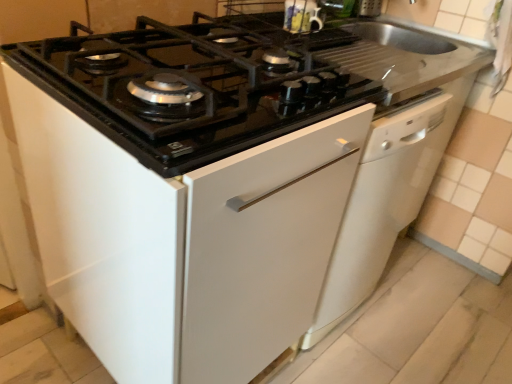
Describe the element at coordinates (194, 86) in the screenshot. This screenshot has height=384, width=512. I see `black glass gas stove at upper center` at that location.

In order to face black glass gas stove at upper center, should I rotate leftwards or rightwards?

A 7.039 degree turn to the left will do.

What are the coordinates of `black glass gas stove at upper center` in the screenshot? It's located at (194, 86).

Identify the location of white glossy dishwasher at center. The image size is (512, 384). (382, 205).

This screenshot has width=512, height=384. What do you see at coordinates (382, 205) in the screenshot?
I see `white glossy dishwasher at center` at bounding box center [382, 205].

Where is `black glass gas stove at upper center`? The height and width of the screenshot is (384, 512). black glass gas stove at upper center is located at coordinates (194, 86).

Is black glass gas stove at upper center to the left of white glossy dishwasher at center from the viewer's perspective?

Yes, black glass gas stove at upper center is to the left of white glossy dishwasher at center.

Which object is further away from the camera taking this photo, black glass gas stove at upper center or white glossy dishwasher at center?

white glossy dishwasher at center.

Considering the points (341, 71) and (377, 234), which point is behind, point (341, 71) or point (377, 234)?

The point (377, 234) is more distant.

From the image's perspective, which object appears higher, black glass gas stove at upper center or white glossy dishwasher at center?

black glass gas stove at upper center.

From a real-world perspective, who is located lower, black glass gas stove at upper center or white glossy dishwasher at center?

From a 3D spatial view, white glossy dishwasher at center is below.

Can you confirm if black glass gas stove at upper center is wider than white glossy dishwasher at center?

Yes, black glass gas stove at upper center is wider than white glossy dishwasher at center.

In terms of height, does black glass gas stove at upper center look taller or shorter compared to white glossy dishwasher at center?

In the image, black glass gas stove at upper center appears to be shorter than white glossy dishwasher at center.

Consider the image. Looking at the image, does black glass gas stove at upper center seem bigger or smaller compared to white glossy dishwasher at center?

In the image, black glass gas stove at upper center appears to be smaller than white glossy dishwasher at center.

Consider the image. Is black glass gas stove at upper center inside the boundaries of white glossy dishwasher at center, or outside?

black glass gas stove at upper center exists outside the volume of white glossy dishwasher at center.

Is black glass gas stove at upper center placed right next to white glossy dishwasher at center?

There is a gap between black glass gas stove at upper center and white glossy dishwasher at center.

Is black glass gas stove at upper center looking in the opposite direction of white glossy dishwasher at center?

No, black glass gas stove at upper center's orientation is not away from white glossy dishwasher at center.

Consider the image. How different are the orientations of black glass gas stove at upper center and white glossy dishwasher at center in degrees?

0.000229 degrees.

How much distance is there between black glass gas stove at upper center and white glossy dishwasher at center?

black glass gas stove at upper center is 18.11 inches away from white glossy dishwasher at center.

You are a GUI agent. You are given a task and a screenshot of the screen. Output one action in this format:
    pyautogui.click(x=<x>, y=<y>)
    Task: Click on the gas stove that appears above the white glossy dishwasher at center (from a real-world perspective)
    
    Given the screenshot: What is the action you would take?
    pyautogui.click(x=194, y=86)

Between white glossy dishwasher at center and black glass gas stove at upper center, which one appears on the left side from the viewer's perspective?

black glass gas stove at upper center.

Is white glossy dishwasher at center in front of or behind black glass gas stove at upper center in the image?

Visually, white glossy dishwasher at center is located behind black glass gas stove at upper center.

Considering the points (451, 112) and (98, 44), which point is behind, point (451, 112) or point (98, 44)?

Positioned behind is point (451, 112).

From the image's perspective, would you say white glossy dishwasher at center is positioned over black glass gas stove at upper center?

No.

From a real-world perspective, is white glossy dishwasher at center positioned under black glass gas stove at upper center based on gravity?

Yes.

Which of these two, white glossy dishwasher at center or black glass gas stove at upper center, is wider?

black glass gas stove at upper center.

In terms of height, does white glossy dishwasher at center look taller or shorter compared to black glass gas stove at upper center?

Clearly, white glossy dishwasher at center is taller compared to black glass gas stove at upper center.

Can you confirm if white glossy dishwasher at center is smaller than black glass gas stove at upper center?

No.

Is black glass gas stove at upper center located within white glossy dishwasher at center?

No, black glass gas stove at upper center is not a part of white glossy dishwasher at center.

Is white glossy dishwasher at center not close to black glass gas stove at upper center?

No, white glossy dishwasher at center is not far from black glass gas stove at upper center.

Could you tell me if white glossy dishwasher at center is turned towards black glass gas stove at upper center?

No, white glossy dishwasher at center is not facing towards black glass gas stove at upper center.

How different are the orientations of white glossy dishwasher at center and black glass gas stove at upper center in degrees?

The facing directions of white glossy dishwasher at center and black glass gas stove at upper center are 0.000229 degrees apart.

How distant is white glossy dishwasher at center from black glass gas stove at upper center?

A distance of 18.11 inches exists between white glossy dishwasher at center and black glass gas stove at upper center.

This screenshot has height=384, width=512. In order to click on gas stove in front of the white glossy dishwasher at center in this screenshot , I will do `click(194, 86)`.

What are the coordinates of `dish washer below the black glass gas stove at upper center (from a real-world perspective)` in the screenshot? It's located at (382, 205).

At what (x,y) coordinates should I click in order to perform the action: click on gas stove on the left of the white glossy dishwasher at center. Please return your answer as a coordinate pair (x, y). Image resolution: width=512 pixels, height=384 pixels. Looking at the image, I should click on (194, 86).